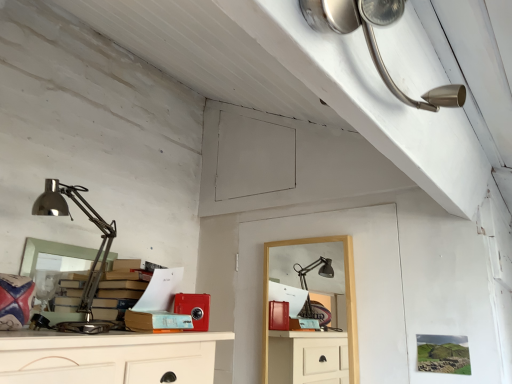
Question: From the image's perspective, is polished metal desk lamp at left, which is the first lamp from bottom to top, beneath satin nickel lamp at upper right, the second lamp from the bottom?

Choices:
 (A) no
 (B) yes

Answer: (B)

Question: From a real-world perspective, is polished metal desk lamp at left, which is counted as the 2th lamp, starting from the front, physically above satin nickel lamp at upper right, the first lamp in the top-to-bottom sequence?

Choices:
 (A) yes
 (B) no

Answer: (B)

Question: From the image's perspective, is polished metal desk lamp at left, which is the 2th lamp from top to bottom, over satin nickel lamp at upper right, the 2th lamp when ordered from back to front?

Choices:
 (A) no
 (B) yes

Answer: (A)

Question: Considering the relative sizes of polished metal desk lamp at left, marked as the first lamp in a back-to-front arrangement, and satin nickel lamp at upper right, arranged as the 1th lamp when viewed from the front, in the image provided, is polished metal desk lamp at left, marked as the first lamp in a back-to-front arrangement, shorter than satin nickel lamp at upper right, arranged as the 1th lamp when viewed from the front,?

Choices:
 (A) yes
 (B) no

Answer: (B)

Question: Is the position of polished metal desk lamp at left, which is counted as the 2th lamp, starting from the front, more distant than that of satin nickel lamp at upper right, the 2th lamp when ordered from back to front?

Choices:
 (A) yes
 (B) no

Answer: (A)

Question: From their relative heights in the image, would you say wooden desk at center is taller or shorter than polished metal desk lamp at left, which is counted as the 2th lamp, starting from the front?

Choices:
 (A) tall
 (B) short

Answer: (A)

Question: Visually, is wooden desk at center positioned to the left or to the right of polished metal desk lamp at left, which is counted as the 2th lamp, starting from the front?

Choices:
 (A) left
 (B) right

Answer: (B)

Question: From a real-world perspective, is wooden desk at center positioned above or below polished metal desk lamp at left, which is the 2th lamp from top to bottom?

Choices:
 (A) above
 (B) below

Answer: (B)

Question: In terms of size, does wooden desk at center appear bigger or smaller than polished metal desk lamp at left, which ranks as the 1th lamp in left-to-right order?

Choices:
 (A) big
 (B) small

Answer: (B)

Question: Is wooden desk at center inside or outside of satin nickel lamp at upper right, the 2th lamp when ordered from back to front?

Choices:
 (A) outside
 (B) inside

Answer: (A)

Question: Does point (349, 249) appear closer or farther from the camera than point (396, 94)?

Choices:
 (A) closer
 (B) farther

Answer: (B)

Question: Considering their positions, is wooden desk at center located in front of or behind satin nickel lamp at upper right, the 1th lamp when ordered from right to left?

Choices:
 (A) behind
 (B) front

Answer: (A)

Question: Considering the positions of wooden desk at center and satin nickel lamp at upper right, the first lamp in the top-to-bottom sequence, in the image, is wooden desk at center taller or shorter than satin nickel lamp at upper right, the first lamp in the top-to-bottom sequence,?

Choices:
 (A) tall
 (B) short

Answer: (A)

Question: In the image, is polished metal desk lamp at left, marked as the first lamp in a back-to-front arrangement, positioned in front of or behind satin nickel lamp at upper right, the 2th lamp viewed from the left?

Choices:
 (A) behind
 (B) front

Answer: (A)

Question: In terms of size, does polished metal desk lamp at left, marked as the first lamp in a back-to-front arrangement, appear bigger or smaller than satin nickel lamp at upper right, the second lamp from the bottom?

Choices:
 (A) big
 (B) small

Answer: (A)